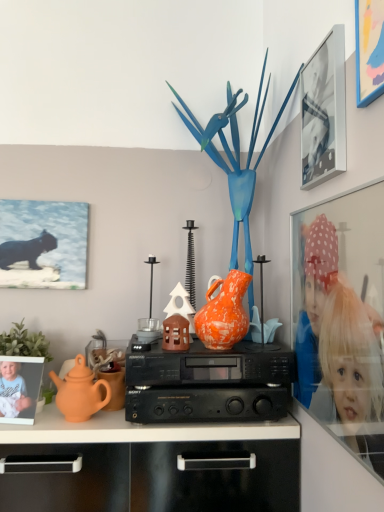
Question: Is blue glossy bird at center in front of or behind green matte plant at left in the image?

Choices:
 (A) behind
 (B) front

Answer: (B)

Question: Is point (228, 86) closer or farther from the camera than point (13, 336)?

Choices:
 (A) closer
 (B) farther

Answer: (B)

Question: Considering the real-world distances, which object is farthest from the green matte plant at left?

Choices:
 (A) blue matte picture frame at upper right, the 1th picture frame positioned from the right
 (B) metallic silver picture frame at upper right, which is counted as the third picture frame, starting from the right
 (C) blue glossy bird at center
 (D) glass photo frame at right, marked as the second picture frame in a right-to-left arrangement
 (E) black plastic stereo at center

Answer: (A)

Question: Which of these objects is positioned closest to the matte orange teapot at left?

Choices:
 (A) metallic silver picture frame at upper right, which is counted as the second picture frame, starting from the back
 (B) matte black cat at upper left, acting as the 1th picture frame starting from the left
 (C) green matte plant at left
 (D) blue glossy bird at center
 (E) blue matte picture frame at upper right, the 4th picture frame in the left-to-right sequence

Answer: (C)